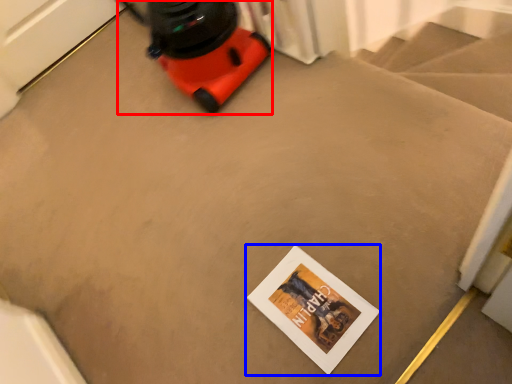
Question: Which object appears farthest to the camera in this image, equipment (highlighted by a red box) or postcard (highlighted by a blue box)?

Choices:
 (A) equipment
 (B) postcard

Answer: (A)